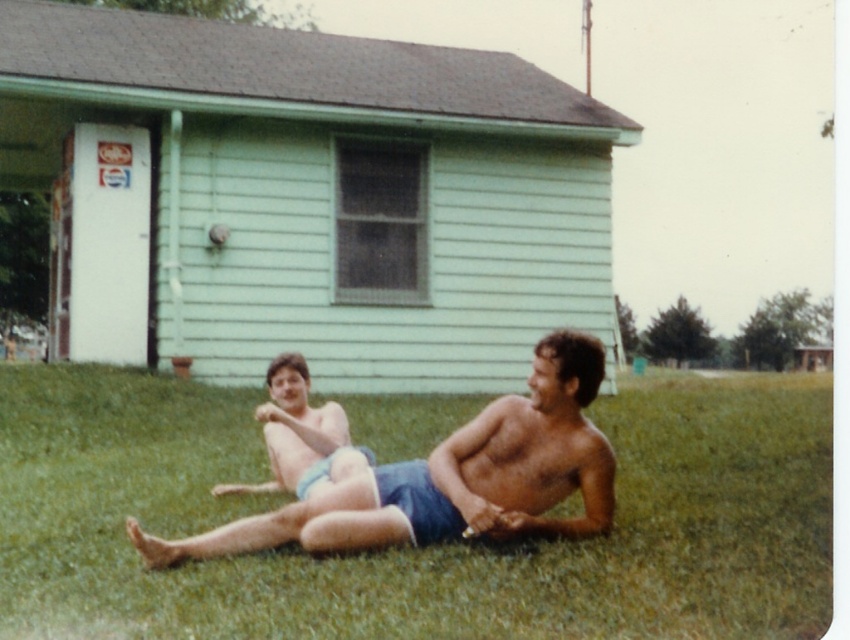
You are a photographer trying to capture the blue denim shorts at center and the blue fabric shorts at center. Which pair of shorts is covering part of the other?

The blue denim shorts at center is positioned under the blue fabric shorts at center, so the blue fabric shorts at center is covering part of the blue denim shorts at center.

You are standing at the point with coordinates (414,548) in the image. What is the color of the ground beneath your feet?

The ground beneath your feet at point (414,548) is green grass at center.

You are standing in front of the light green house with a dark gray roof and a white door. You see the green grass at center and the blue fabric shorts at center. Which object is closer to you?

The green grass at center is closer to the viewer than the blue fabric shorts at center.